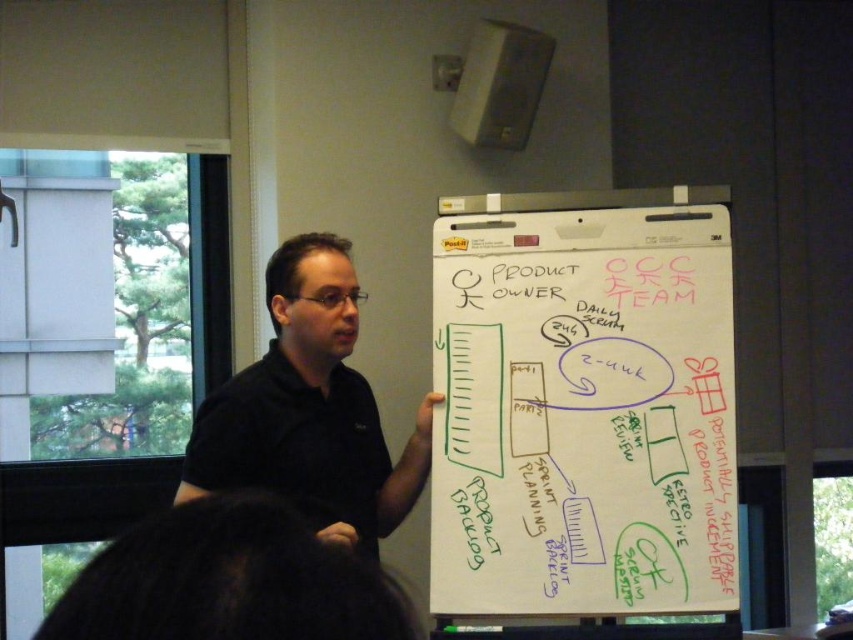
Question: Which point is farther to the camera?

Choices:
 (A) (318, 248)
 (B) (502, 584)

Answer: (A)

Question: Is whiteboard at center above black shirt at center?

Choices:
 (A) no
 (B) yes

Answer: (A)

Question: Which point is farther from the camera taking this photo?

Choices:
 (A) (300, 477)
 (B) (505, 220)

Answer: (B)

Question: Can you confirm if whiteboard at center is smaller than black shirt at center?

Choices:
 (A) yes
 (B) no

Answer: (A)

Question: Can you confirm if whiteboard at center is bigger than black shirt at center?

Choices:
 (A) yes
 (B) no

Answer: (B)